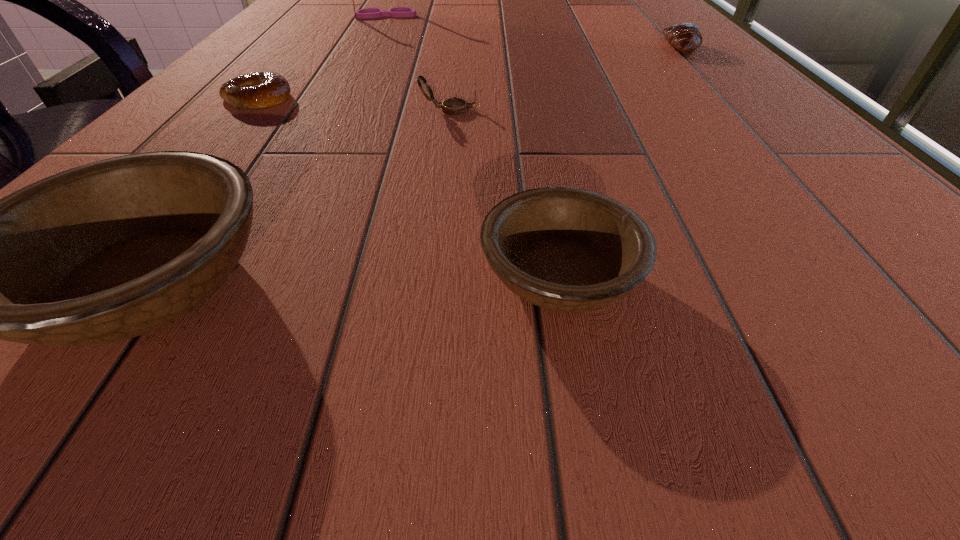
The width and height of the screenshot is (960, 540). Find the location of `the right bowl`. the right bowl is located at coordinates (565, 249).

You are a GUI agent. You are given a task and a screenshot of the screen. Output one action in this format:
    pyautogui.click(x=<x>, y=<y>)
    Task: Click on the shorter bowl
    This screenshot has width=960, height=540.
    Given the screenshot: What is the action you would take?
    pyautogui.click(x=565, y=249)

Find the location of a particular element. the second shortest object is located at coordinates (686, 37).

You are a GUI agent. You are given a task and a screenshot of the screen. Output one action in this format:
    pyautogui.click(x=<x>, y=<y>)
    Task: Click on the rightmost object
    The height and width of the screenshot is (540, 960).
    Given the screenshot: What is the action you would take?
    pyautogui.click(x=686, y=37)

This screenshot has width=960, height=540. In order to click on the shortest object in this screenshot , I will do `click(262, 89)`.

Identify the location of compass. (453, 106).

You are a GUI agent. You are given a task and a screenshot of the screen. Output one action in this format:
    pyautogui.click(x=<x>, y=<y>)
    Task: Click on the tallest object
    
    Given the screenshot: What is the action you would take?
    pyautogui.click(x=396, y=11)

Locate an element on the screen. the farthest object is located at coordinates (396, 11).

This screenshot has width=960, height=540. In order to click on vacant space situated on the back of the second object from right to left in this screenshot , I will do `click(535, 134)`.

Image resolution: width=960 pixels, height=540 pixels. I want to click on vacant space located on the front of the crescent roll, so click(719, 86).